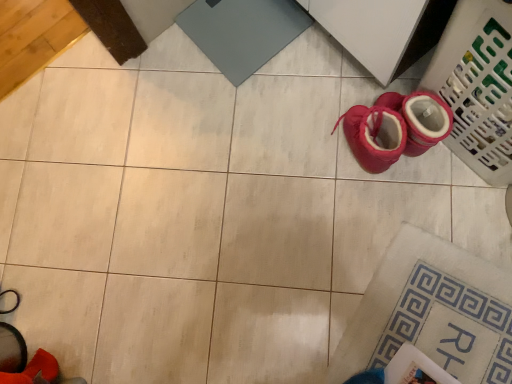
Question: Is plastic laundry basket at lower right to the left of red suede boot at lower left from the viewer's perspective?

Choices:
 (A) yes
 (B) no

Answer: (B)

Question: From a real-world perspective, is plastic laundry basket at lower right located beneath red suede boot at lower left?

Choices:
 (A) yes
 (B) no

Answer: (A)

Question: Is plastic laundry basket at lower right located outside red suede boot at lower left?

Choices:
 (A) yes
 (B) no

Answer: (A)

Question: Is plastic laundry basket at lower right at the right side of red suede boot at lower left?

Choices:
 (A) no
 (B) yes

Answer: (B)

Question: Is plastic laundry basket at lower right far from red suede boot at lower left?

Choices:
 (A) no
 (B) yes

Answer: (B)

Question: Can you confirm if plastic laundry basket at lower right is shorter than red suede boot at lower left?

Choices:
 (A) yes
 (B) no

Answer: (B)

Question: Can you confirm if red suede boot at lower left is wider than plastic laundry basket at lower right?

Choices:
 (A) no
 (B) yes

Answer: (A)

Question: Can plastic laundry basket at lower right be found inside red suede boot at lower left?

Choices:
 (A) yes
 (B) no

Answer: (B)

Question: Is the depth of red suede boot at lower left greater than that of plastic laundry basket at lower right?

Choices:
 (A) yes
 (B) no

Answer: (B)

Question: Considering the relative sizes of red suede boot at lower left and plastic laundry basket at lower right in the image provided, is red suede boot at lower left shorter than plastic laundry basket at lower right?

Choices:
 (A) no
 (B) yes

Answer: (B)

Question: Is red suede boot at lower left next to plastic laundry basket at lower right?

Choices:
 (A) yes
 (B) no

Answer: (B)

Question: From the image's perspective, is red suede boot at lower left beneath plastic laundry basket at lower right?

Choices:
 (A) no
 (B) yes

Answer: (B)

Question: From a real-world perspective, is red suede boot at lower left physically located above or below plastic laundry basket at lower right?

Choices:
 (A) above
 (B) below

Answer: (A)